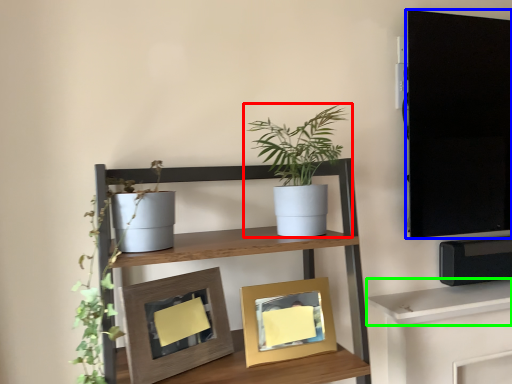
Question: Which is farther away from houseplant (highlighted by a red box)? tv cabinet (highlighted by a blue box) or shelf (highlighted by a green box)?

Choices:
 (A) tv cabinet
 (B) shelf

Answer: (B)